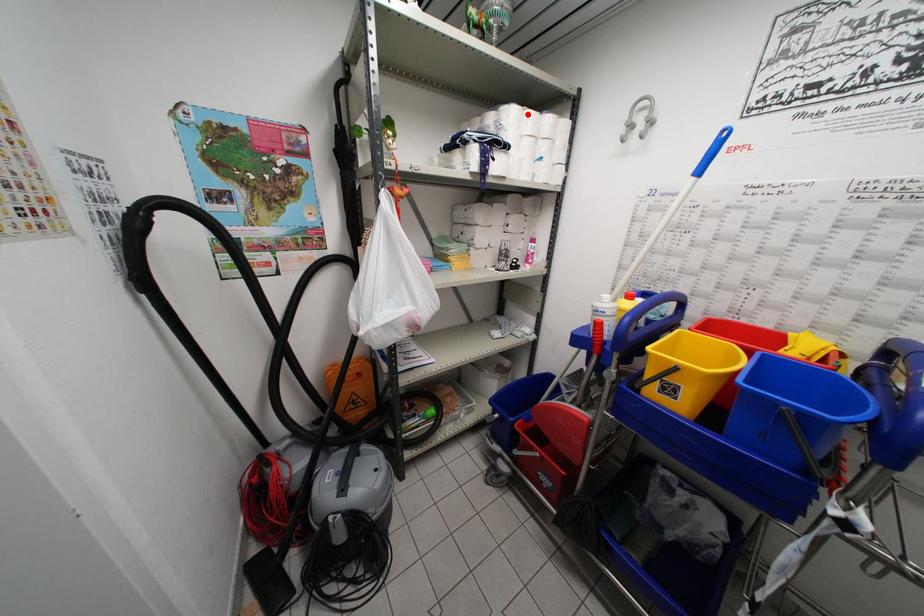
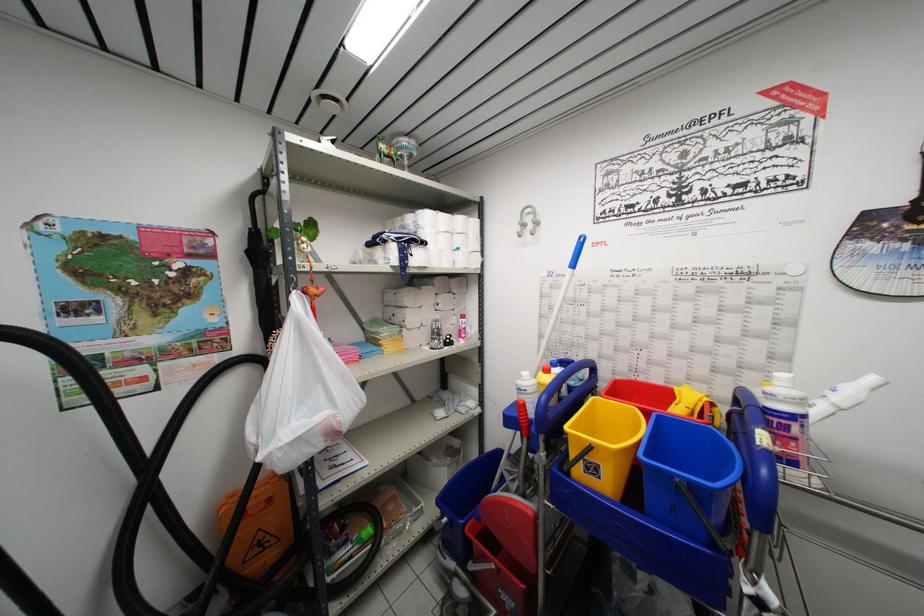
Locate, in the second image, the point that corresponds to the highlighted location in the first image.

(441, 217)